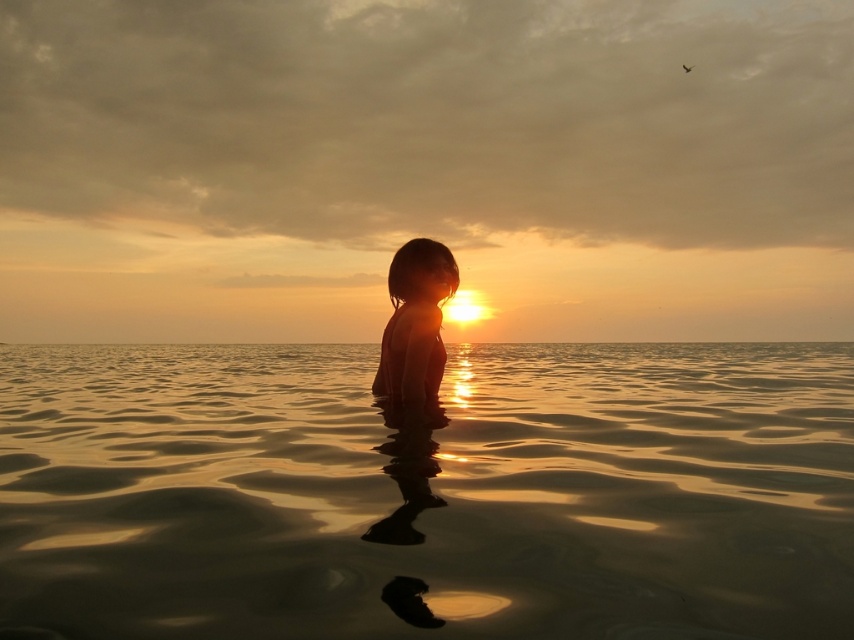
Question: Can you confirm if glistening golden water at center is positioned to the left of silhouette skin at center?

Choices:
 (A) no
 (B) yes

Answer: (B)

Question: Which point is closer to the camera?

Choices:
 (A) glistening golden water at center
 (B) silhouette skin at center

Answer: (A)

Question: Which point is closer to the camera?

Choices:
 (A) glistening golden water at center
 (B) silhouette skin at center
 (C) golden water at center

Answer: (A)

Question: Can you confirm if glistening golden water at center is smaller than golden water at center?

Choices:
 (A) yes
 (B) no

Answer: (B)

Question: Is the position of glistening golden water at center more distant than that of silhouette skin at center?

Choices:
 (A) no
 (B) yes

Answer: (A)

Question: Estimate the real-world distances between objects in this image. Which object is closer to the golden water at center?

Choices:
 (A) silhouette skin at center
 (B) glistening golden water at center

Answer: (B)